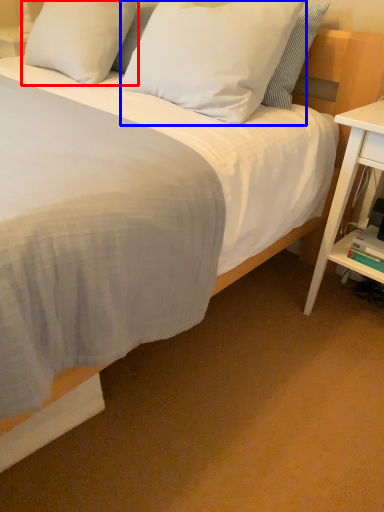
Question: Among these objects, which one is nearest to the camera, pillow (highlighted by a red box) or pillow (highlighted by a blue box)?

Choices:
 (A) pillow
 (B) pillow

Answer: (B)